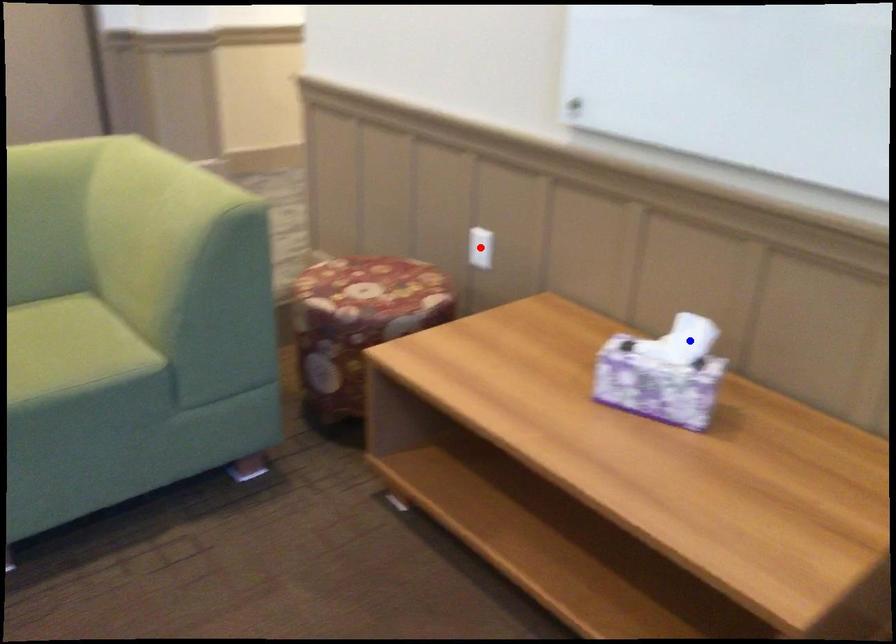
Question: Which of the two points in the image is closer to the camera?

Choices:
 (A) Blue point is closer.
 (B) Red point is closer.

Answer: (A)